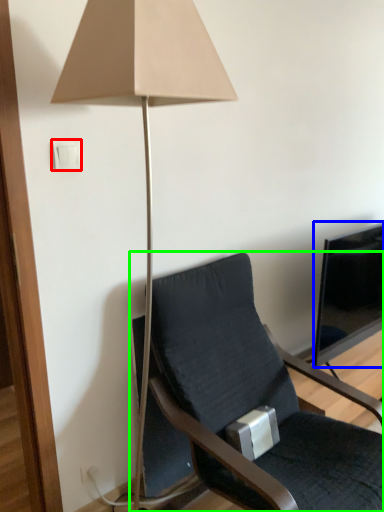
Question: Estimate the real-world distances between objects in this image. Which object is farther from light switch (highlighted by a red box), television (highlighted by a blue box) or chair (highlighted by a green box)?

Choices:
 (A) television
 (B) chair

Answer: (A)